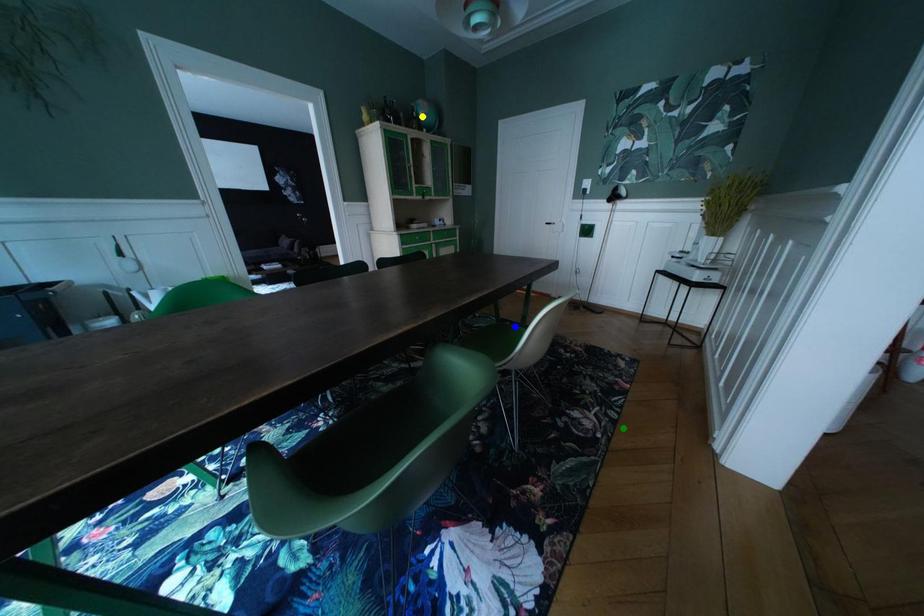
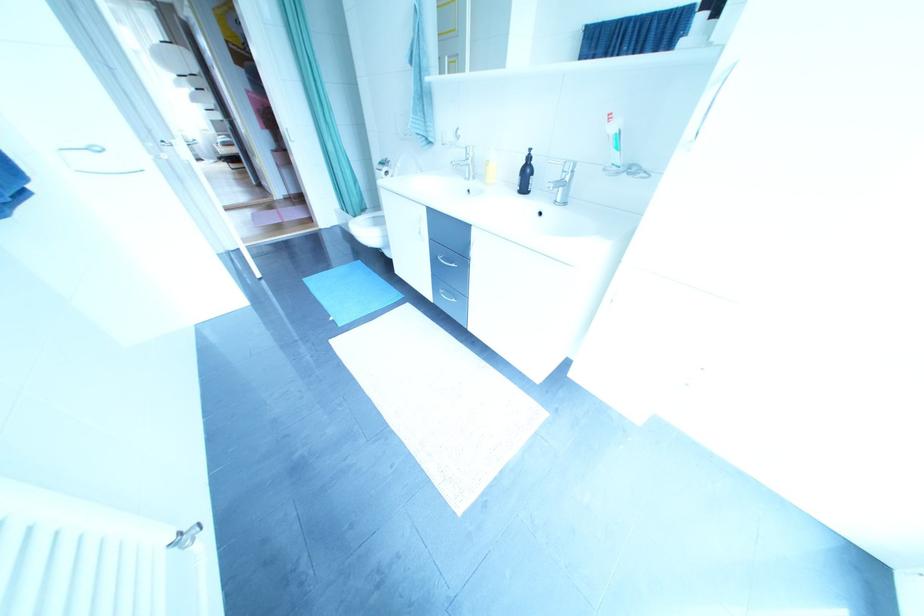
I am providing you with two images of the same scene from different viewpoints. Three points are marked in image1. Which point corresponds to a part or object that is occluded in image2?In image1, three points are marked. Which of them correspond to a part or object that is occluded in image2?Among the three points shown in image1, which one corresponds to a part or object that is no longer visible due to occlusion in image2?

green point, yellow point, blue point cannot be seen in image2.